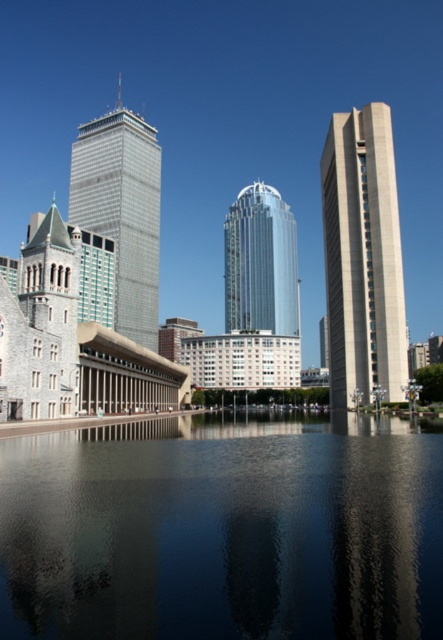
You are an architect analyzing the urban layout. Based on the scene, which object is located below the other between the beige concrete tower at right and the metallic glass skyscraper at center?

The beige concrete tower at right is positioned under the metallic glass skyscraper at center.

You are a photographer aiming to capture the beige concrete tower at right and the metallic glass skyscraper at center in a single shot. Based on their positions, which one will appear closer to the camera in the photo?

The beige concrete tower at right will appear closer to the camera because it is positioned in front of the metallic glass skyscraper at center.